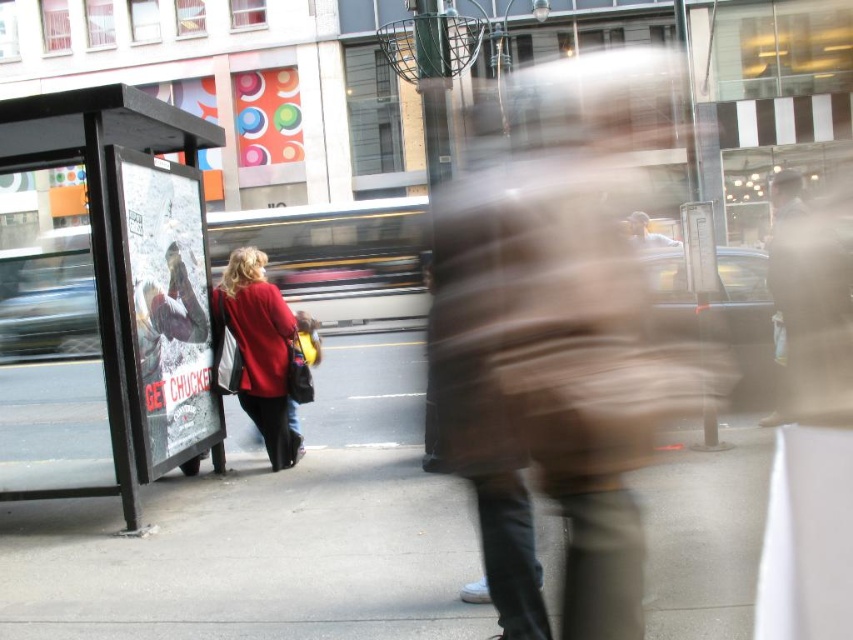
Which is below, black plastic bus stop at left or matte red coat at center?

matte red coat at center

Between point (9, 166) and point (245, 410), which one is positioned behind?

The point (245, 410) is behind.

Where is `black plastic bus stop at left`? The width and height of the screenshot is (853, 640). black plastic bus stop at left is located at coordinates (99, 218).

Is point (120, 106) less distant than point (804, 348)?

Yes, point (120, 106) is in front of point (804, 348).

Looking at this image, does black plastic bus stop at left appear over brown leather jacket at right?

No.

At what (x,y) coordinates should I click in order to perform the action: click on black plastic bus stop at left. Please return your answer as a coordinate pair (x, y). Image resolution: width=853 pixels, height=640 pixels. Looking at the image, I should click on (99, 218).

Between gray concrete sidewalk at center and brown leather jacket at right, which one is positioned higher?

brown leather jacket at right is above.

Does point (428, 483) lie in front of point (796, 380)?

Yes, point (428, 483) is in front of point (796, 380).

Identify the location of gray concrete sidewalk at center. This screenshot has height=640, width=853. (253, 557).